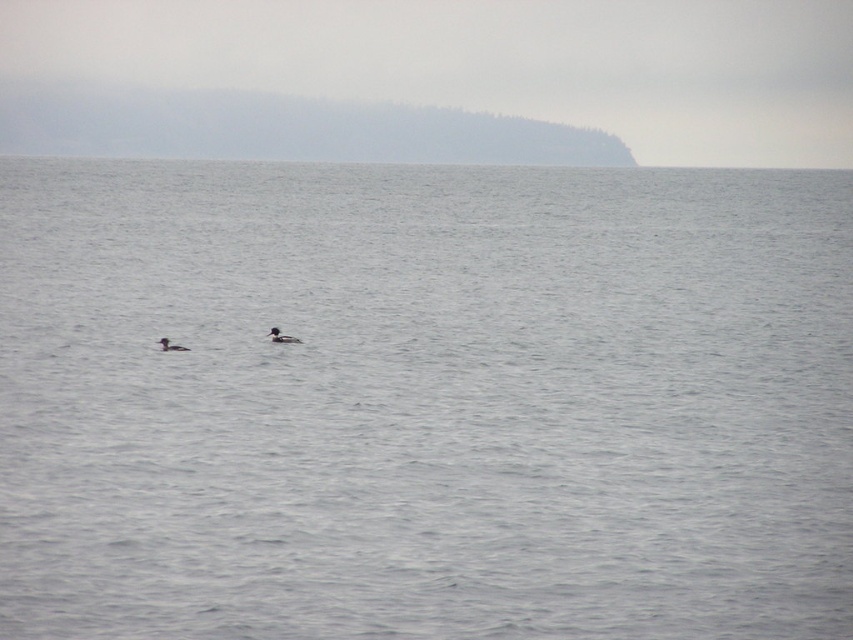
Question: Can you confirm if brown matte duck at center is positioned to the right of dark brown duck at center?

Choices:
 (A) yes
 (B) no

Answer: (A)

Question: Does brown matte duck at center come behind dark brown duck at center?

Choices:
 (A) yes
 (B) no

Answer: (A)

Question: Which object appears farthest from the camera in this image?

Choices:
 (A) dark brown duck at center
 (B) brown matte duck at center

Answer: (B)

Question: Which point is farther to the camera?

Choices:
 (A) (178, 349)
 (B) (280, 337)

Answer: (B)

Question: Is brown matte duck at center below dark brown duck at center?

Choices:
 (A) no
 (B) yes

Answer: (A)